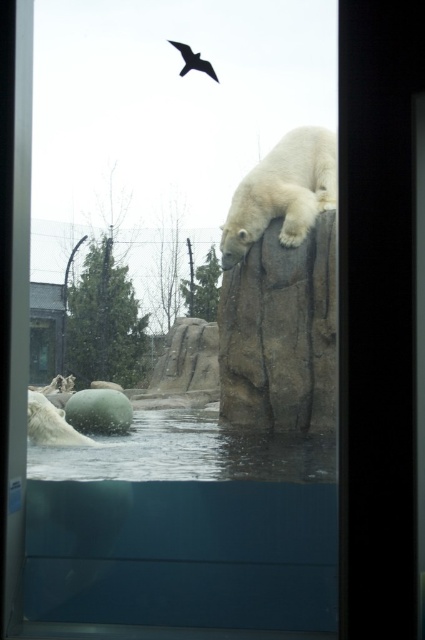
You are standing at the point marked as point (251, 288) and want to reach the polar bear on the rock. The path between them is 6.26 meters. If you can walk at a speed of 1.5 meters per second, how many seconds will it take you to reach the polar bear?

The distance between point (251, 288) and the polar bear is 6.26 meters. At a walking speed of 1.5 meters per second, it would take approximately 4.17 seconds to reach the polar bear.

You are a zookeeper trying to feed the white fur bear at upper center. You have a bucket of fish at the transparent glass pool at lower center. Can you directly hand the fish to the bear without moving the bucket?

The transparent glass pool at lower center is positioned under the white fur bear at upper center, so yes, you can directly hand the fish to the bear by lifting the bucket from the pool area upwards since the bear is above the pool.